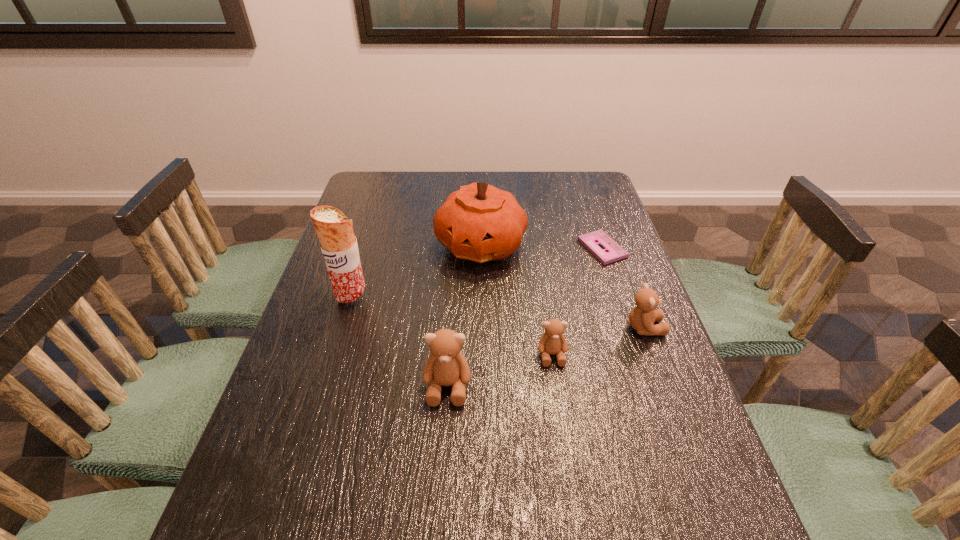
Where is `the leftmost teddy bear`? This screenshot has height=540, width=960. the leftmost teddy bear is located at coordinates (446, 365).

You are a GUI agent. You are given a task and a screenshot of the screen. Output one action in this format:
    pyautogui.click(x=<x>, y=<y>)
    Task: Click on the tallest teddy bear
    
    Given the screenshot: What is the action you would take?
    pyautogui.click(x=446, y=365)

Locate an element on the screen. the second teddy bear from left to right is located at coordinates (552, 342).

Locate an element on the screen. the shortest teddy bear is located at coordinates (552, 342).

Where is `the third shortest object`? The image size is (960, 540). the third shortest object is located at coordinates (642, 317).

The image size is (960, 540). What are the coordinates of `the farthest teddy bear` in the screenshot? It's located at (642, 317).

Find the location of a particular element. This screenshot has width=960, height=540. the second tallest object is located at coordinates (480, 223).

Locate an element on the screen. the shortest object is located at coordinates coord(613,251).

Locate an element on the screen. the leftmost object is located at coordinates (338, 244).

At what (x,y) coordinates should I click in order to perform the action: click on the fourth nearest object. Please return your answer as a coordinate pair (x, y). This screenshot has width=960, height=540. Looking at the image, I should click on (338, 244).